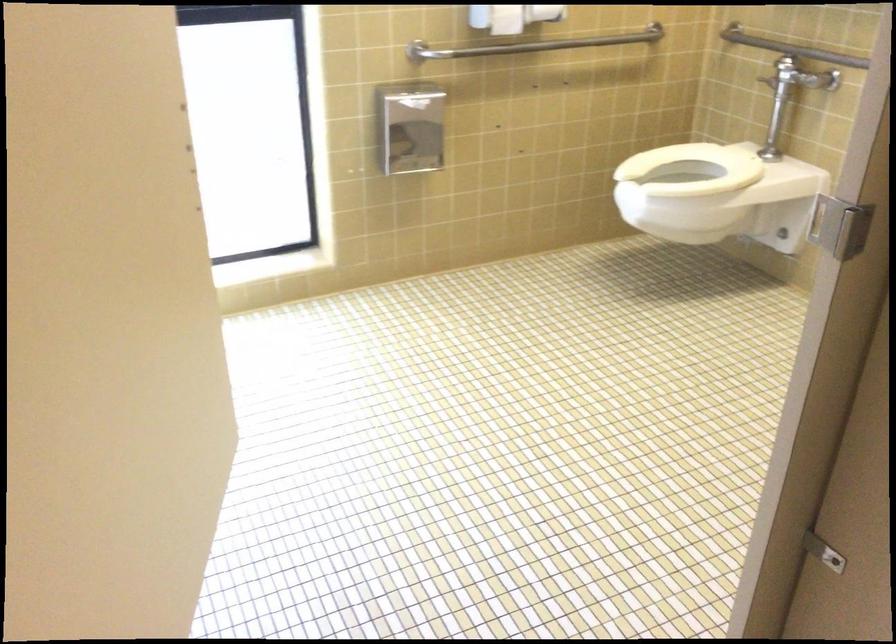
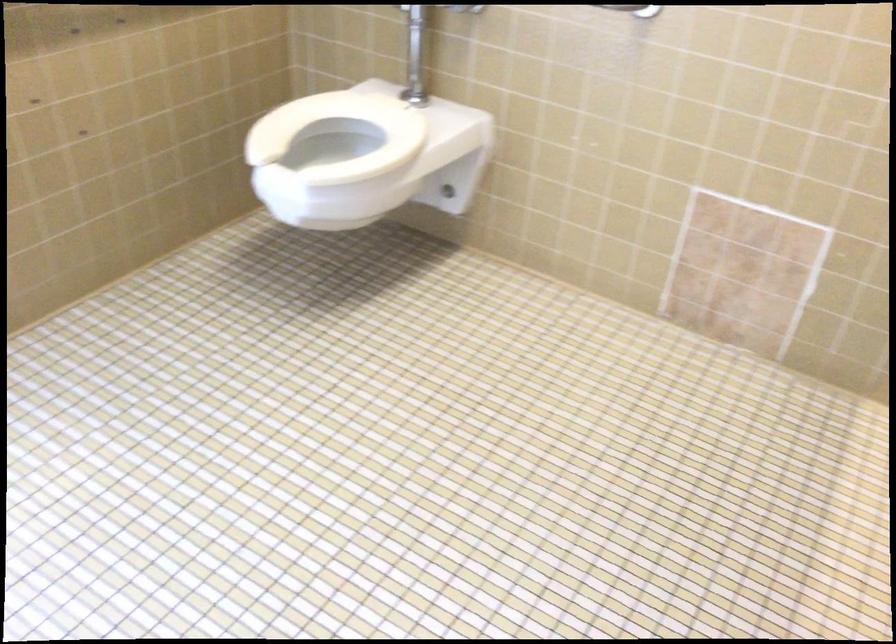
In the second image, find the point that corresponds to point (780, 118) in the first image.

(415, 55)